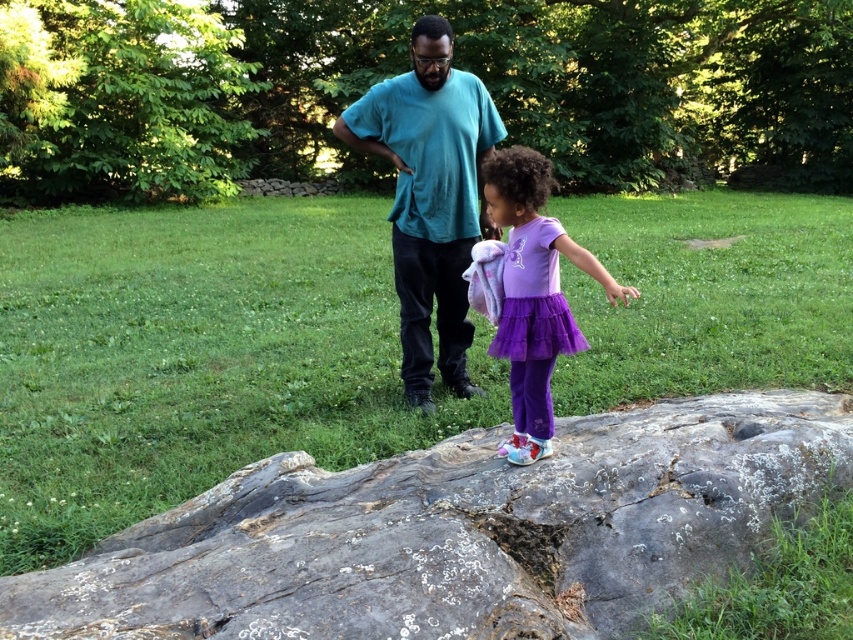
Question: Is teal matte shirt at center thinner than purple tulle skirt at center?

Choices:
 (A) yes
 (B) no

Answer: (B)

Question: Which point is farther to the camera?

Choices:
 (A) rough gray rock at center
 (B) purple tulle skirt at center
 (C) teal matte shirt at center

Answer: (C)

Question: Which point is farther to the camera?

Choices:
 (A) rough gray rock at center
 (B) teal matte shirt at center
 (C) purple tulle skirt at center

Answer: (B)

Question: Which of the following is the closest to the observer?

Choices:
 (A) (376, 131)
 (B) (413, 541)

Answer: (B)

Question: Does teal matte shirt at center appear on the left side of purple tulle skirt at center?

Choices:
 (A) no
 (B) yes

Answer: (B)

Question: Does rough gray rock at center have a lesser width compared to teal matte shirt at center?

Choices:
 (A) no
 (B) yes

Answer: (A)